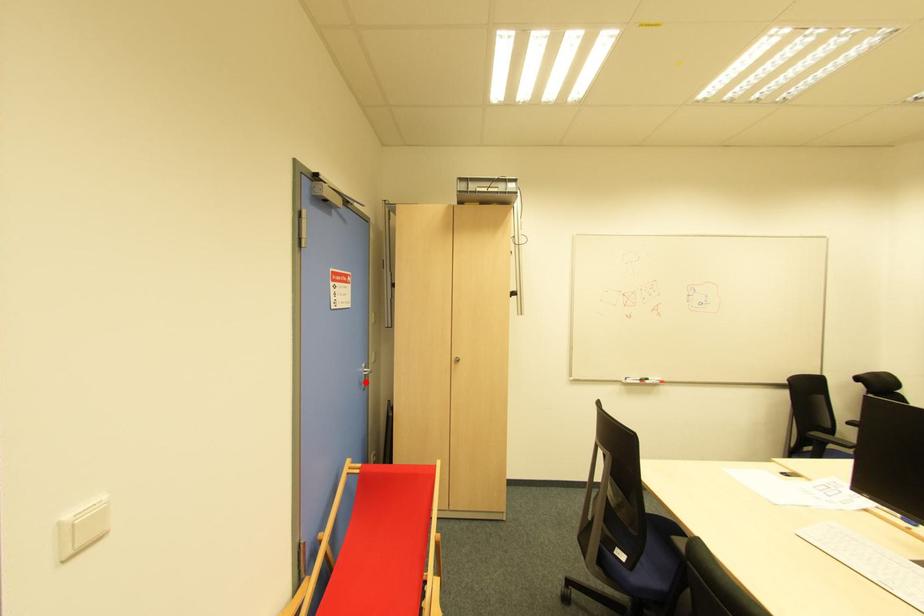
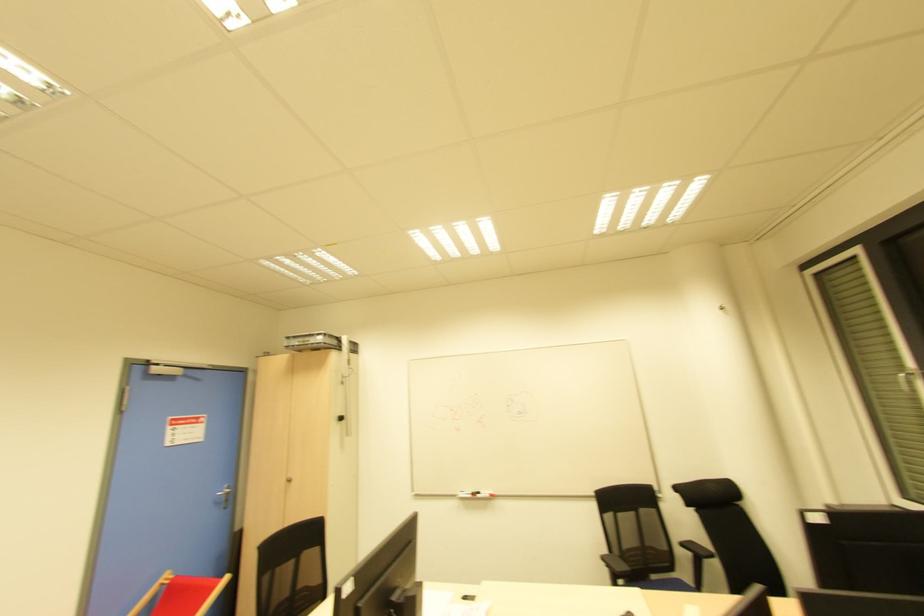
Find the pixel in the second image that matches the highlighted location in the first image.

(225, 501)